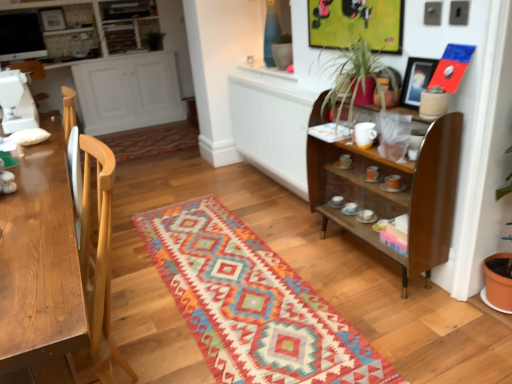
Image resolution: width=512 pixels, height=384 pixels. I want to click on vacant space in multicolored woven mat at center (from a real-world perspective), so click(248, 296).